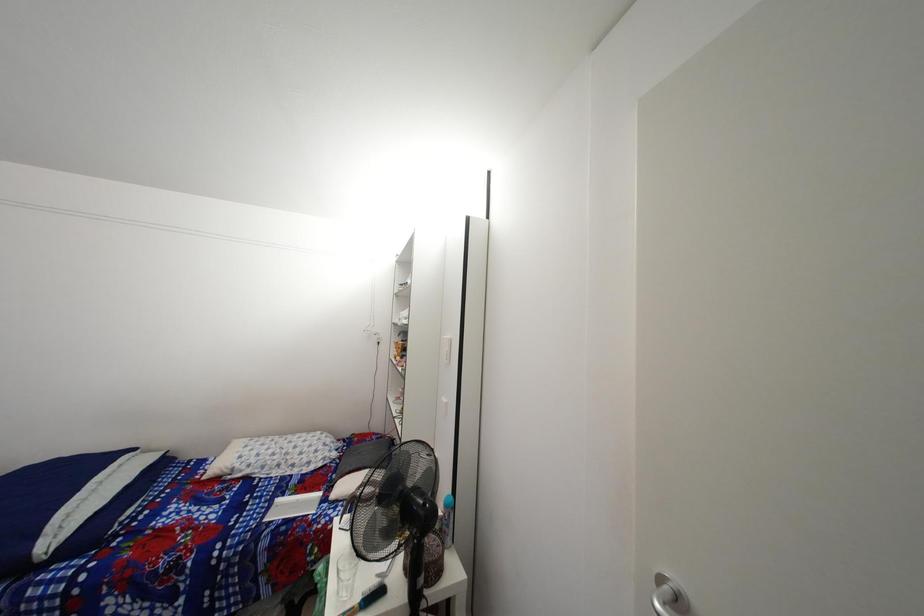
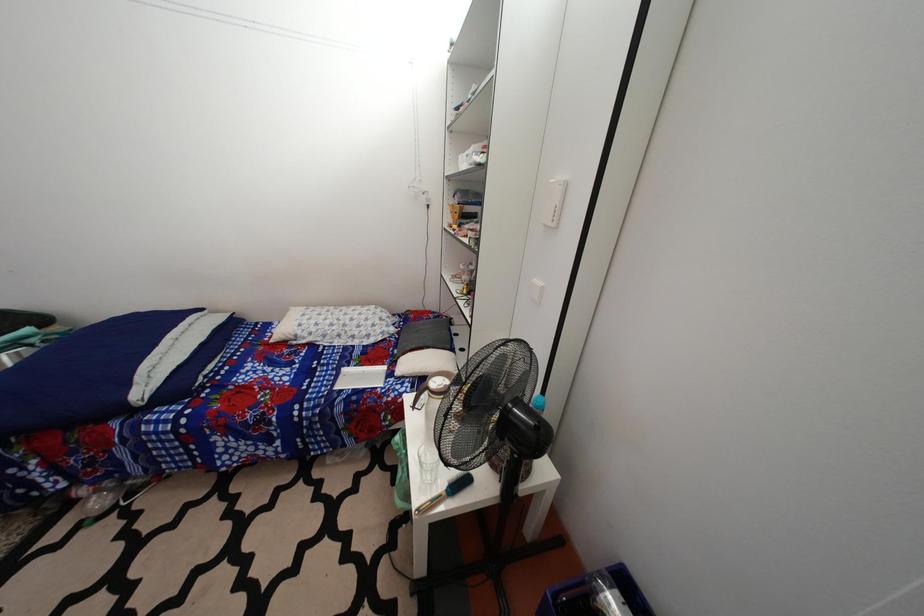
Question: Based on the continuous images, in which direction is the camera rotating? Reply with the corresponding letter.

Choices:
 (A) Left
 (B) Right
 (C) Up
 (D) Down

Answer: (D)